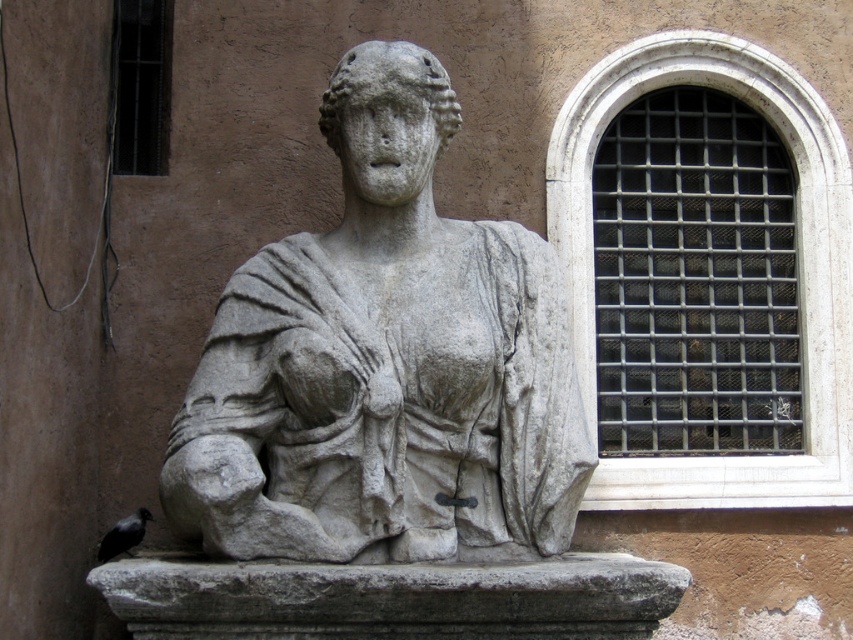
You are an art conservator assessing the statue. You need to determine if the gray stone bust at center can be moved through a doorway that is the same height as the metallic grid window at upper right. Can it fit vertically?

The gray stone bust at center is taller than the metallic grid window at upper right. Since the doorway is the same height as the window, the bust would not fit vertically through the doorway.

You are an art conservator examining the statue. You notice two metallic grids in the background. Which one is closer to you, the metallic grid window at upper right or the metallic grid at upper left?

The metallic grid at upper left is behind metallic grid window at upper right, so the metallic grid window at upper right is closer to you.